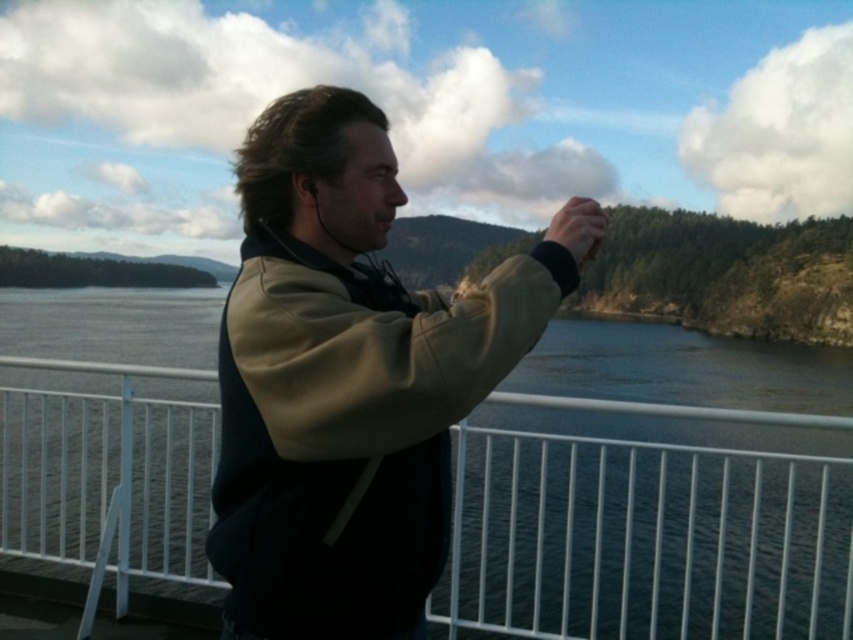
Is white metal rail at center to the right of khaki fleece jacket at center from the viewer's perspective?

Yes, white metal rail at center is to the right of khaki fleece jacket at center.

Which is more to the left, white metal rail at center or khaki fleece jacket at center?

Positioned to the left is khaki fleece jacket at center.

Does point (811, 545) lie behind point (305, 250)?

That is True.

The image size is (853, 640). Find the location of `white metal rail at center`. white metal rail at center is located at coordinates (643, 540).